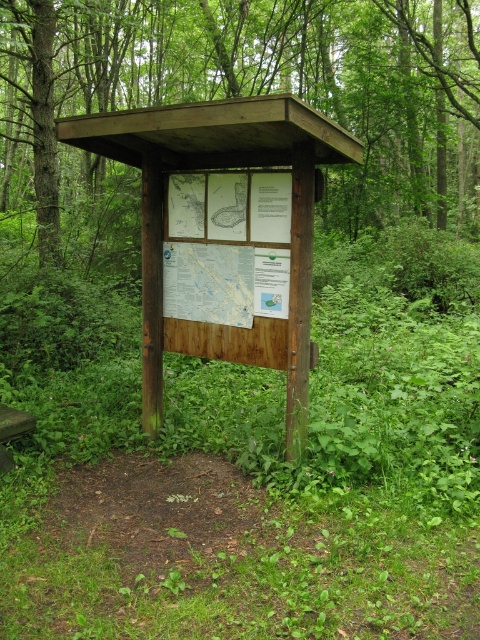
Question: Which point is closer to the camera taking this photo?

Choices:
 (A) (289, 358)
 (B) (389, 182)

Answer: (A)

Question: Does brown wood sign at center have a smaller size compared to wooden signboard at center?

Choices:
 (A) no
 (B) yes

Answer: (A)

Question: Is the position of brown wood sign at center less distant than that of wooden signboard at center?

Choices:
 (A) yes
 (B) no

Answer: (B)

Question: Which point is farther from the camera taking this photo?

Choices:
 (A) (169, 237)
 (B) (136, 72)

Answer: (B)

Question: Does brown wood sign at center have a smaller size compared to wooden signboard at center?

Choices:
 (A) yes
 (B) no

Answer: (B)